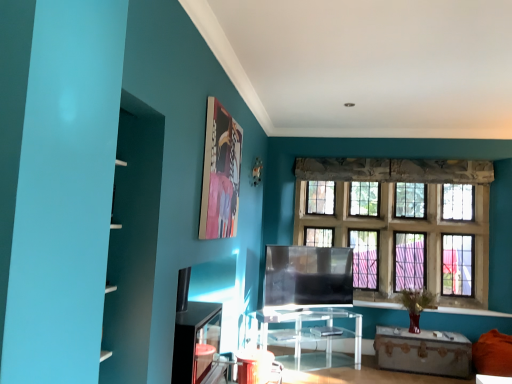
Image resolution: width=512 pixels, height=384 pixels. I want to click on matte blue bookshelf at left, so click(56, 182).

Find the location of a particular element. This screenshot has height=384, width=512. clear glass windows at center is located at coordinates (401, 218).

Where is `transparent glass tv at center`? Image resolution: width=512 pixels, height=384 pixels. transparent glass tv at center is located at coordinates (308, 276).

Where is `rustic wooden trunk at lower right, the second table when ordered from left to right`? rustic wooden trunk at lower right, the second table when ordered from left to right is located at coordinates (423, 352).

Based on the photo, from the image's perspective, is matte blue bookshelf at left on top of rustic wooden trunk at lower right, marked as the 1th table in a right-to-left arrangement?

Correct, matte blue bookshelf at left appears higher than rustic wooden trunk at lower right, marked as the 1th table in a right-to-left arrangement, in the image.

Is matte blue bookshelf at left oriented away from rustic wooden trunk at lower right, marked as the 1th table in a right-to-left arrangement?

No, matte blue bookshelf at left's orientation is not away from rustic wooden trunk at lower right, marked as the 1th table in a right-to-left arrangement.

Does point (35, 86) appear closer or farther from the camera than point (423, 350)?

Point (35, 86) is closer to the camera than point (423, 350).

How different are the orientations of matte blue bookshelf at left and rustic wooden trunk at lower right, marked as the 1th table in a right-to-left arrangement, in degrees?

They differ by 92 degrees in their facing directions.

Based on the photo, based on their sizes in the image, would you say orange fabric couch at lower right is bigger or smaller than matte plastic picture frame at upper center?

Clearly, orange fabric couch at lower right is larger in size than matte plastic picture frame at upper center.

From a real-world perspective, is orange fabric couch at lower right over matte plastic picture frame at upper center?

No.

Does orange fabric couch at lower right have a greater width compared to matte plastic picture frame at upper center?

Yes, orange fabric couch at lower right is wider than matte plastic picture frame at upper center.

Is orange fabric couch at lower right not close to matte plastic picture frame at upper center?

Indeed, orange fabric couch at lower right is not near matte plastic picture frame at upper center.

From a real-world perspective, is matte plastic picture frame at upper center above or below matte blue bookshelf at left?

In terms of real-world spatial position, matte plastic picture frame at upper center is above matte blue bookshelf at left.

Relative to matte blue bookshelf at left, is matte plastic picture frame at upper center in front or behind?

In the image, matte plastic picture frame at upper center appears behind matte blue bookshelf at left.

How different are the orientations of matte plastic picture frame at upper center and matte blue bookshelf at left in degrees?

matte plastic picture frame at upper center and matte blue bookshelf at left are facing 1.47 degrees away from each other.

Identify the location of picture frame above the matte blue bookshelf at left (from the image's perspective). The image size is (512, 384). (220, 173).

You are a GUI agent. You are given a task and a screenshot of the screen. Output one action in this format:
    pyautogui.click(x=<x>, y=<y>)
    Task: Click on the window screen on the left side of orange fabric couch at lower right
    Image resolution: width=512 pixels, height=384 pixels.
    Given the screenshot: What is the action you would take?
    pyautogui.click(x=308, y=276)

From the image's perspective, which is below, transparent glass tv at center or orange fabric couch at lower right?

orange fabric couch at lower right, from the image's perspective.

Would you say transparent glass tv at center is inside or outside orange fabric couch at lower right?

transparent glass tv at center is outside orange fabric couch at lower right.

What are the coordinates of `window screen on the right of matte plastic picture frame at upper center` in the screenshot? It's located at (308, 276).

From the image's perspective, is matte plastic picture frame at upper center above transparent glass tv at center?

Yes, from the image's perspective, matte plastic picture frame at upper center is over transparent glass tv at center.

Between matte plastic picture frame at upper center and transparent glass tv at center, which one has smaller width?

Thinner between the two is matte plastic picture frame at upper center.

Considering the sizes of matte blue bookshelf at left and matte plastic picture frame at upper center in the image, is matte blue bookshelf at left taller or shorter than matte plastic picture frame at upper center?

Considering their sizes, matte blue bookshelf at left has more height than matte plastic picture frame at upper center.

From the image's perspective, is matte blue bookshelf at left beneath matte plastic picture frame at upper center?

Yes.

From a real-world perspective, is matte blue bookshelf at left above or below matte plastic picture frame at upper center?

matte blue bookshelf at left is situated lower than matte plastic picture frame at upper center in the real world.

Can you tell me how much clear glass windows at center and matte blue bookshelf at left differ in facing direction?

They differ by 90 degrees in their facing directions.

Would you say clear glass windows at center is to the left or to the right of matte blue bookshelf at left in the picture?

Clearly, clear glass windows at center is on the right of matte blue bookshelf at left in the image.

Is clear glass windows at center not within matte blue bookshelf at left?

Yes.

Looking at their sizes, would you say clear glass windows at center is wider or thinner than matte blue bookshelf at left?

Considering their sizes, clear glass windows at center looks slimmer than matte blue bookshelf at left.

Starting from the matte blue bookshelf at left, which table is the 2nd one behind? Please provide its 2D coordinates.

[(423, 352)]

Where is `couch below the matte plastic picture frame at upper center (from a real-world perspective)`? The height and width of the screenshot is (384, 512). couch below the matte plastic picture frame at upper center (from a real-world perspective) is located at coordinates (493, 354).

Based on the photo, estimate the real-world distances between objects in this image. Which object is further from matte plastic picture frame at upper center, transparent acrylic table at center, the first table when ordered from left to right, or clear glass windows at center?

clear glass windows at center is positioned further to the anchor matte plastic picture frame at upper center.

Which object lies further to the anchor point transparent glass tv at center, matte blue bookshelf at left or clear glass windows at center?

matte blue bookshelf at left is positioned further to the anchor transparent glass tv at center.

Based on their spatial positions, is matte plastic picture frame at upper center or matte blue bookshelf at left further from transparent acrylic table at center, the first table when ordered from left to right?

The object further to transparent acrylic table at center, the first table when ordered from left to right, is matte blue bookshelf at left.

Based on their spatial positions, is orange fabric couch at lower right or matte plastic picture frame at upper center closer to matte blue bookshelf at left?

matte plastic picture frame at upper center is positioned closer to the anchor matte blue bookshelf at left.

Considering their positions, is orange fabric couch at lower right positioned further to transparent glass tv at center than rustic wooden trunk at lower right, marked as the 1th table in a right-to-left arrangement?

The object further to transparent glass tv at center is orange fabric couch at lower right.

Which object lies nearer to the anchor point matte blue bookshelf at left, transparent glass tv at center or matte plastic picture frame at upper center?

matte plastic picture frame at upper center lies closer to matte blue bookshelf at left than the other object.

Estimate the real-world distances between objects in this image. Which object is further from rustic wooden trunk at lower right, the second table when ordered from left to right, transparent acrylic table at center, the first table when ordered from left to right, or clear glass windows at center?

clear glass windows at center is further to rustic wooden trunk at lower right, the second table when ordered from left to right.

When comparing their distances from transparent glass tv at center, does matte plastic picture frame at upper center or matte blue bookshelf at left seem closer?

matte plastic picture frame at upper center.

Identify the location of table between matte blue bookshelf at left and rustic wooden trunk at lower right, marked as the 1th table in a right-to-left arrangement, in the front-back direction. (307, 330).

The width and height of the screenshot is (512, 384). I want to click on window screen situated between matte plastic picture frame at upper center and orange fabric couch at lower right from left to right, so click(x=308, y=276).

Locate an element on the screen. The width and height of the screenshot is (512, 384). table located between transparent acrylic table at center, the 2th table in the right-to-left sequence, and orange fabric couch at lower right in the left-right direction is located at coordinates (423, 352).

You are a GUI agent. You are given a task and a screenshot of the screen. Output one action in this format:
    pyautogui.click(x=<x>, y=<y>)
    Task: Click on the couch that lies between clear glass windows at center and rustic wooden trunk at lower right, the second table when ordered from left to right, from top to bottom
    
    Given the screenshot: What is the action you would take?
    pyautogui.click(x=493, y=354)